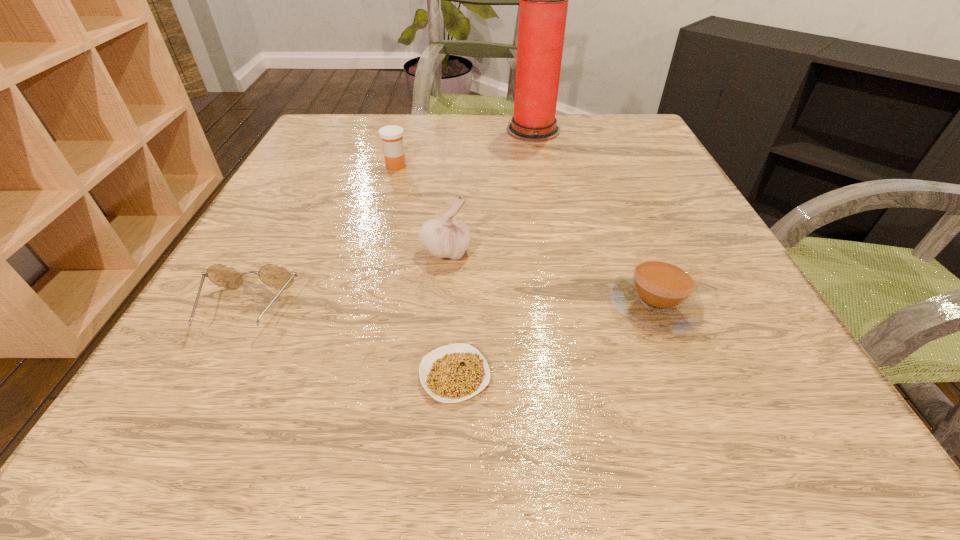
Where is `fire extinguisher`? fire extinguisher is located at coordinates (543, 6).

This screenshot has height=540, width=960. What are the coordinates of `the tallest object` in the screenshot? It's located at (543, 6).

The height and width of the screenshot is (540, 960). In order to click on the second tallest object in this screenshot , I will do point(447,237).

Where is `the fourth nearest object`? The image size is (960, 540). the fourth nearest object is located at coordinates (447, 237).

What are the coordinates of `the second farthest object` in the screenshot? It's located at (392, 141).

This screenshot has height=540, width=960. In order to click on the second object from left to right in this screenshot , I will do `click(392, 141)`.

This screenshot has height=540, width=960. Identify the location of cappuccino. (659, 295).

Image resolution: width=960 pixels, height=540 pixels. In order to click on the fifth tallest object in this screenshot , I will do [275, 276].

You are a GUI agent. You are given a task and a screenshot of the screen. Output one action in this format:
    pyautogui.click(x=<x>, y=<y>)
    Task: Click on the leftmost object
    Image resolution: width=960 pixels, height=540 pixels.
    Given the screenshot: What is the action you would take?
    pyautogui.click(x=275, y=276)

Find the location of a particular element. The image size is (960, 540). legume is located at coordinates (453, 373).